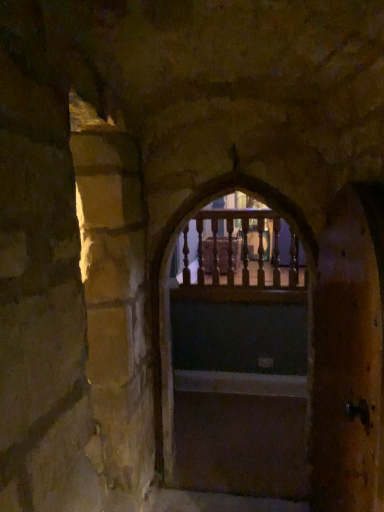
Identify the location of free point above smooth wooden stairs at center (from a real-world perspective). (237, 430).